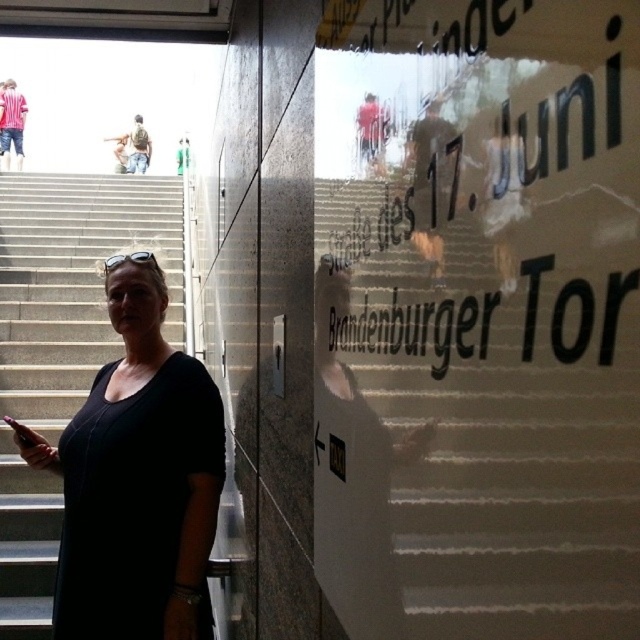
Question: Is denim jacket at upper left smaller than camouflage fabric shirt at upper left?

Choices:
 (A) yes
 (B) no

Answer: (B)

Question: Estimate the real-world distances between objects in this image. Which object is farther from the camouflage fabric shirt at upper left?

Choices:
 (A) denim jacket at upper left
 (B) black matte dress at center

Answer: (B)

Question: Does black matte dress at center appear over denim jacket at upper left?

Choices:
 (A) no
 (B) yes

Answer: (A)

Question: Can you confirm if black matte dress at center is positioned to the left of denim jacket at upper left?

Choices:
 (A) yes
 (B) no

Answer: (B)

Question: Which object is positioned farthest from the camouflage fabric shirt at upper left?

Choices:
 (A) black matte dress at center
 (B) denim jacket at upper left

Answer: (A)

Question: Estimate the real-world distances between objects in this image. Which object is closer to the denim jacket at upper left?

Choices:
 (A) camouflage fabric shirt at upper left
 (B) black matte dress at center

Answer: (A)